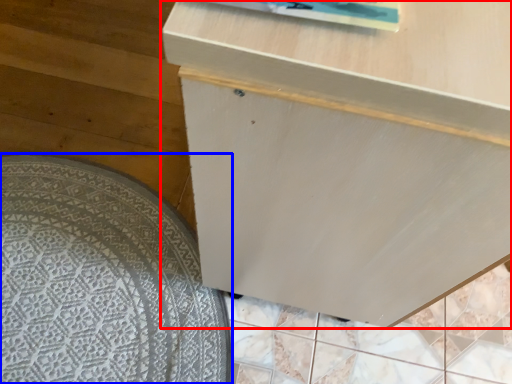
Question: Which object appears farthest to the camera in this image, furniture (highlighted by a red box) or mat (highlighted by a blue box)?

Choices:
 (A) furniture
 (B) mat

Answer: (B)